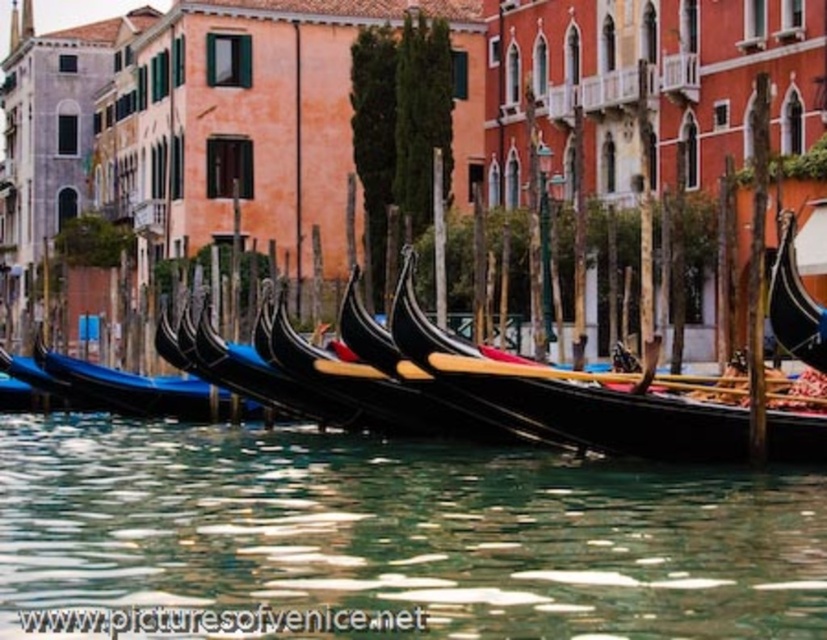
Who is taller, black polished wood gondola at center or shiny black gondola at center?

With more height is black polished wood gondola at center.

What do you see at coordinates (575, 397) in the screenshot?
I see `black polished wood gondola at center` at bounding box center [575, 397].

Does point (627, 394) lie behind point (815, 348)?

Yes, point (627, 394) is behind point (815, 348).

Where is `black polished wood gondola at center`? Image resolution: width=827 pixels, height=640 pixels. black polished wood gondola at center is located at coordinates (575, 397).

Which is above, black polished wood gondola at center or shiny black gondola at left?

Positioned higher is black polished wood gondola at center.

Is black polished wood gondola at center taller than shiny black gondola at left?

Indeed, black polished wood gondola at center has a greater height compared to shiny black gondola at left.

The image size is (827, 640). What do you see at coordinates (575, 397) in the screenshot? I see `black polished wood gondola at center` at bounding box center [575, 397].

Find the location of `black polished wood gondola at center`. black polished wood gondola at center is located at coordinates (575, 397).

Does transparent glass water at center have a lesser height compared to shiny black gondola at left?

Indeed, transparent glass water at center has a lesser height compared to shiny black gondola at left.

Who is higher up, transparent glass water at center or shiny black gondola at left?

Positioned higher is shiny black gondola at left.

In order to click on transparent glass water at center in this screenshot , I will do `click(394, 534)`.